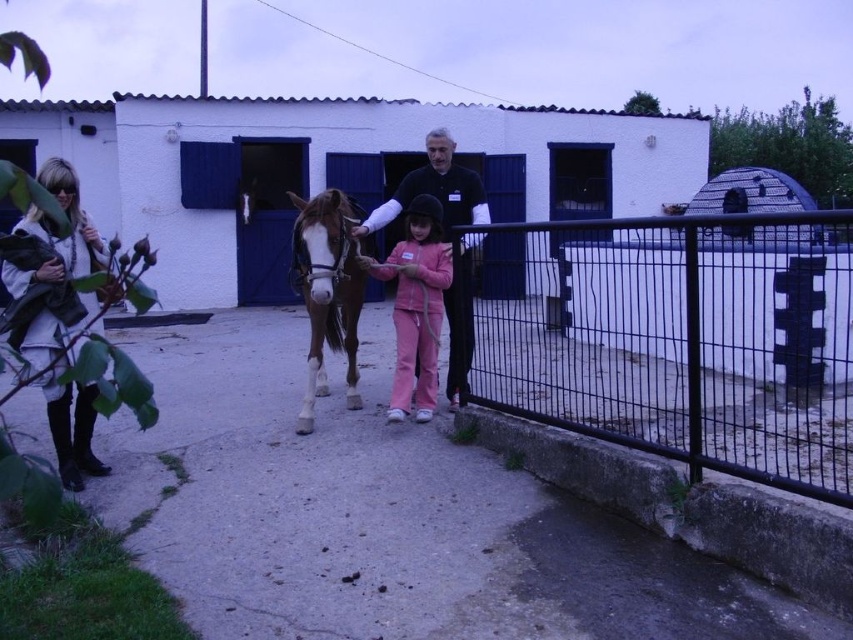
Is black metal fence at right to the right of black matte shirt at center from the viewer's perspective?

Indeed, black metal fence at right is positioned on the right side of black matte shirt at center.

This screenshot has width=853, height=640. In order to click on black metal fence at right in this screenshot , I will do `click(682, 340)`.

At what (x,y) coordinates should I click in order to perform the action: click on black metal fence at right. Please return your answer as a coordinate pair (x, y). Looking at the image, I should click on (682, 340).

Who is taller, white textured coat at left or black matte shirt at center?

black matte shirt at center

Based on the photo, which of these two, white textured coat at left or black matte shirt at center, stands shorter?

With less height is white textured coat at left.

Which is in front, point (41, 339) or point (469, 362)?

Positioned in front is point (41, 339).

Locate an element on the screen. The width and height of the screenshot is (853, 640). white textured coat at left is located at coordinates (62, 396).

Is point (634, 324) farther from viewer compared to point (350, 220)?

Yes.

Is black metal fence at right positioned behind brown glossy horse at center?

Yes.

Is point (613, 308) farther from viewer compared to point (341, 237)?

Yes, it is.

Locate an element on the screen. This screenshot has height=640, width=853. black metal fence at right is located at coordinates (682, 340).